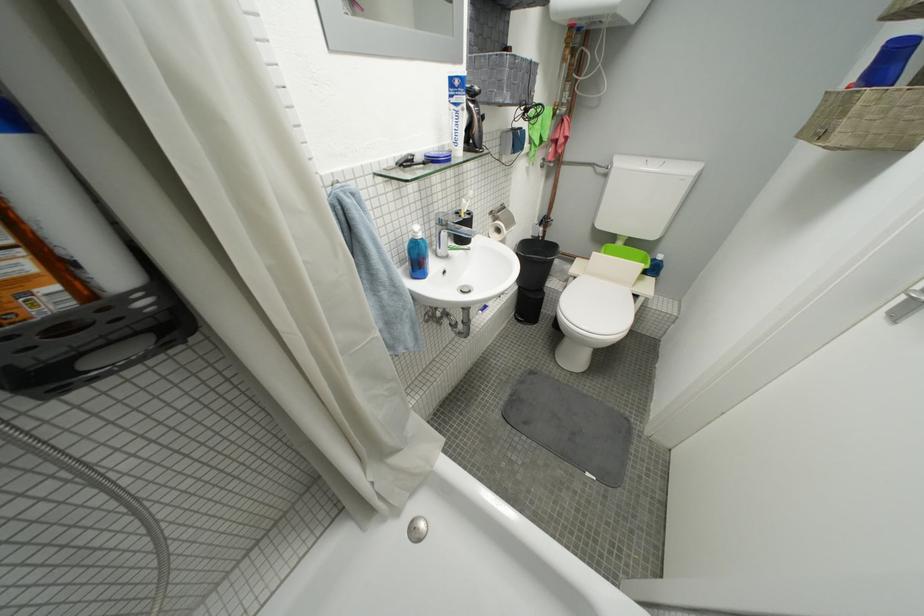
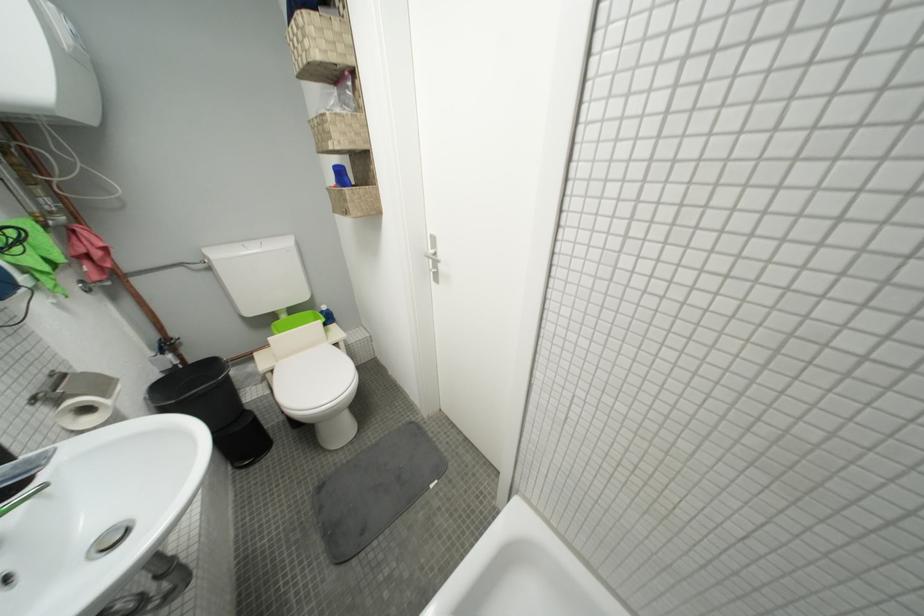
In the second image, find the point that corresponds to the point at 628,246 in the first image.

(293, 318)